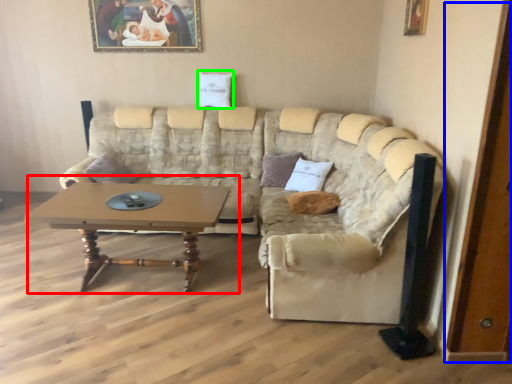
Question: Based on their relative distances, which object is nearer to coffee table (highlighted by a red box)? Choose from door (highlighted by a blue box) and pillow (highlighted by a green box).

Choices:
 (A) door
 (B) pillow

Answer: (B)